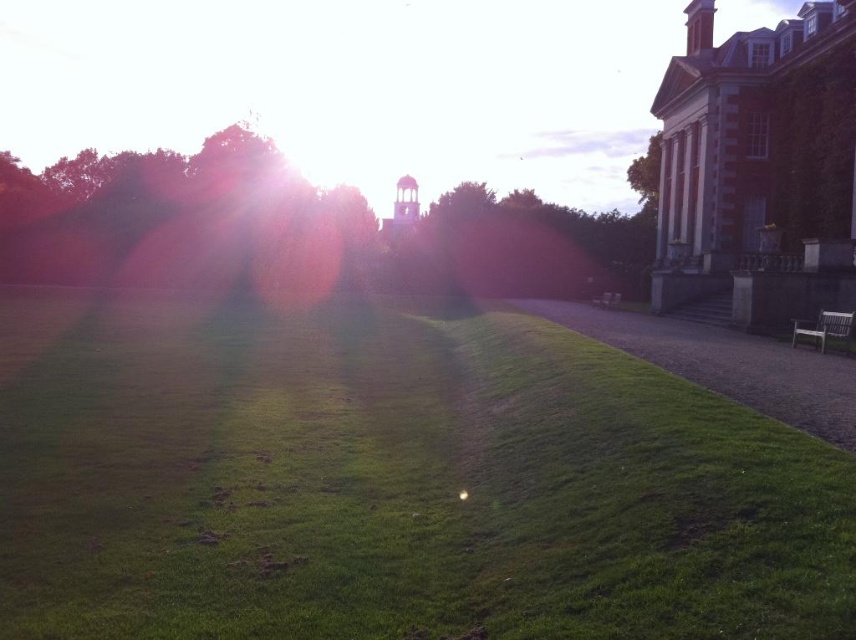
Question: Which of the following is the closest to the observer?

Choices:
 (A) (617, 300)
 (B) (807, 336)

Answer: (B)

Question: Which object appears closest to the camera in this image?

Choices:
 (A) metallic silver bench at center
 (B) green grassy at center

Answer: (B)

Question: Can you confirm if white wooden bench at right is positioned above metallic silver bench at center?

Choices:
 (A) no
 (B) yes

Answer: (A)

Question: Can you confirm if green grassy at center is thinner than white wooden bench at right?

Choices:
 (A) no
 (B) yes

Answer: (A)

Question: Which point appears farthest from the camera in this image?

Choices:
 (A) (831, 332)
 (B) (116, 502)

Answer: (A)

Question: Does white wooden bench at right have a greater width compared to metallic silver bench at center?

Choices:
 (A) no
 (B) yes

Answer: (A)